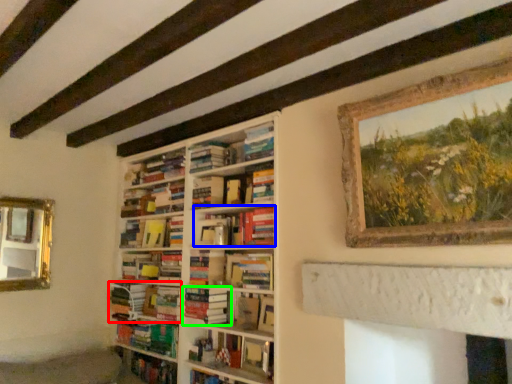
Question: Estimate the real-world distances between objects in this image. Which object is closer to book (highlighted by a red box), book (highlighted by a blue box) or book (highlighted by a green box)?

Choices:
 (A) book
 (B) book

Answer: (B)